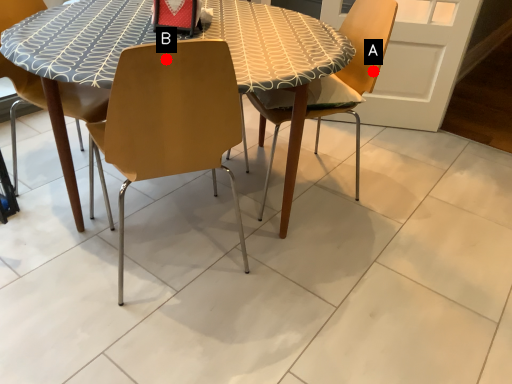
Question: Two points are circled on the image, labeled by A and B beside each circle. Which point is further to the camera?

Choices:
 (A) A is further
 (B) B is further

Answer: (A)